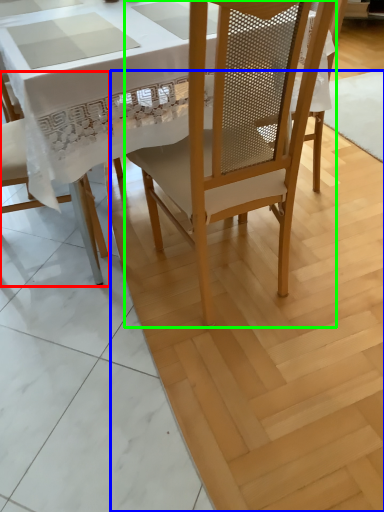
Question: Considering the real-world distances, which object is closest to chair (highlighted by a red box)? plywood (highlighted by a blue box) or chair (highlighted by a green box).

Choices:
 (A) plywood
 (B) chair

Answer: (A)